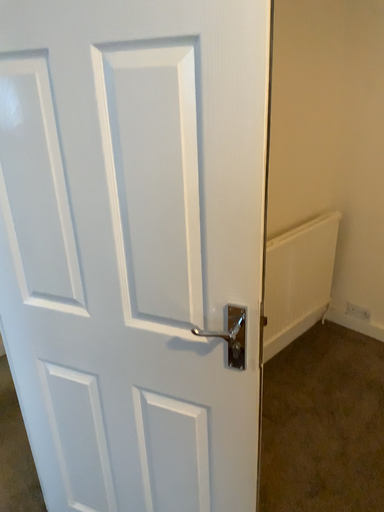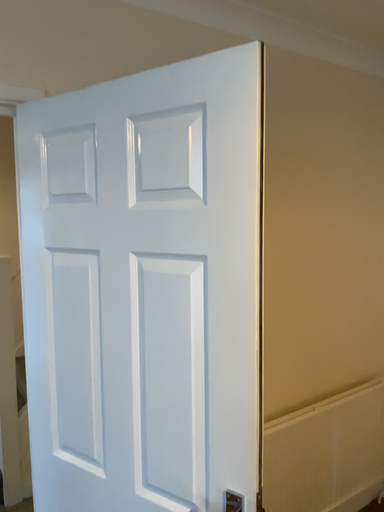
Question: How did the camera likely rotate when shooting the video?

Choices:
 (A) rotated left
 (B) rotated right

Answer: (A)